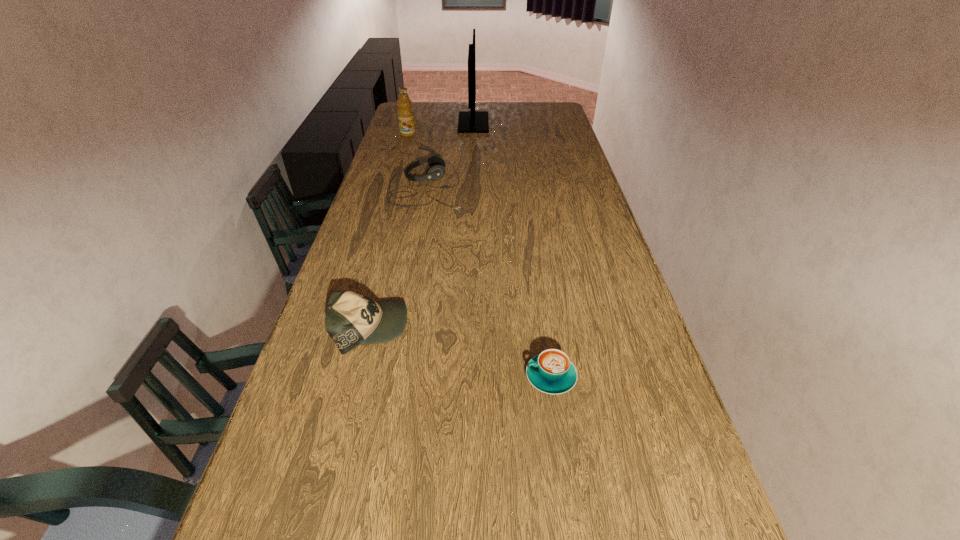
The image size is (960, 540). I want to click on vacant area situated 0.400m with the handle on the right side of the rightmost object, so click(351, 376).

At what (x,y) coordinates should I click in order to perform the action: click on free space located with the handle on the right side of the rightmost object. Please return your answer as a coordinate pair (x, y). Looking at the image, I should click on (451, 376).

This screenshot has height=540, width=960. Find the location of `free space located 0.250m with the handle on the right side of the rightmost object`. free space located 0.250m with the handle on the right side of the rightmost object is located at coordinates (417, 376).

You are a GUI agent. You are given a task and a screenshot of the screen. Output one action in this format:
    pyautogui.click(x=<x>, y=<y>)
    Task: Click on the object that is at the far edge
    
    Given the screenshot: What is the action you would take?
    pyautogui.click(x=472, y=121)

In order to click on olive oil that is at the left edge in this screenshot , I will do `click(405, 112)`.

This screenshot has height=540, width=960. What are the coordinates of `headset that is at the left edge` in the screenshot? It's located at (437, 164).

Identify the location of baseball cap that is positioned at the left edge. Image resolution: width=960 pixels, height=540 pixels. (351, 319).

Where is `free space at the far edge of the desktop`? free space at the far edge of the desktop is located at coordinates (436, 109).

Locate an element on the screen. This screenshot has height=540, width=960. vacant space at the left edge of the desktop is located at coordinates (396, 138).

You are a GUI agent. You are given a task and a screenshot of the screen. Output one action in this format:
    pyautogui.click(x=<x>, y=<y>)
    Task: Click on the vacant space at the right edge
    Image resolution: width=960 pixels, height=540 pixels.
    Given the screenshot: What is the action you would take?
    pyautogui.click(x=648, y=408)